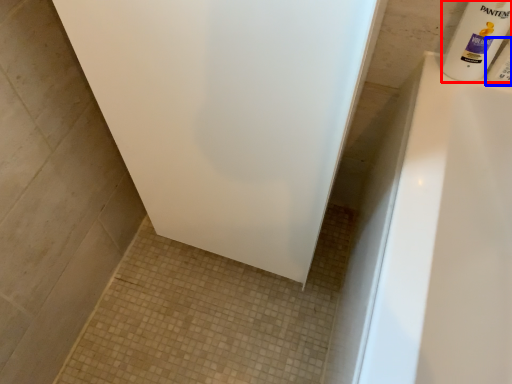
Question: Among these objects, which one is farthest to the camera, cleaning product (highlighted by a red box) or toiletry (highlighted by a blue box)?

Choices:
 (A) cleaning product
 (B) toiletry

Answer: (B)